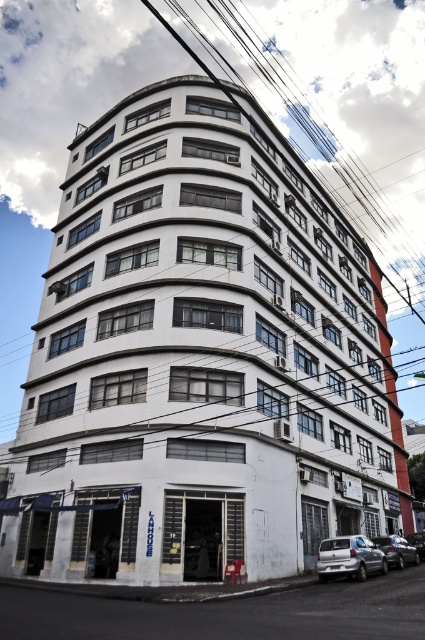
You are a delivery driver who needs to park your vehicle between the white matte car at lower right and the silver metallic sedan at lower right. Can you fit your 2.5 meter wide delivery van in the space between them?

The white matte car at lower right has a lesser width compared to silver metallic sedan at lower right. The total width between them would depend on their combined widths, but since the white car is narrower, the space between might be sufficient. However, without exact measurements, it is uncertain. Please check the available space carefully before attempting to park.

You are a delivery person trying to park your van in the parking lot near the LANHOUSE entrance. There are two vehicles blocking the space where you need to park. The white matte car at lower right and the shiny black sedan at lower right. Which vehicle is blocking your path more directly?

The white matte car at lower right is positioned over the shiny black sedan at lower right, so the white matte car at lower right is directly blocking the path more than the shiny black sedan at lower right.

You are a delivery person arriving at the LANHOUSE entrance. You need to park your shiny black sedan at lower right but must avoid hitting the black wire at upper center. Can you safely park your car there without the wire obstructing the path?

The black wire at upper center is above the shiny black sedan at lower right, so parking the car there would not interfere with the wire as it is positioned above and out of the way.